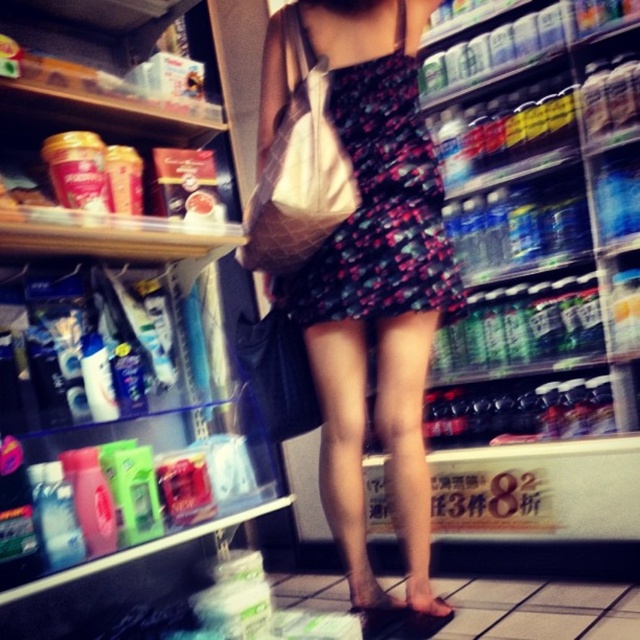
Based on the photo, can you confirm if floral-patterned fabric dress at center is positioned to the right of matte black sandal at lower center?

Incorrect, floral-patterned fabric dress at center is not on the right side of matte black sandal at lower center.

Is floral-patterned fabric dress at center thinner than matte black sandal at lower center?

In fact, floral-patterned fabric dress at center might be wider than matte black sandal at lower center.

The height and width of the screenshot is (640, 640). I want to click on floral-patterned fabric dress at center, so click(380, 196).

Is floral dress at center taller than matte black sandal at lower center?

Correct, floral dress at center is much taller as matte black sandal at lower center.

Which is more to the left, floral dress at center or matte black sandal at lower center?

From the viewer's perspective, floral dress at center appears more on the left side.

I want to click on floral dress at center, so click(x=369, y=264).

Find the location of a particular element. This screenshot has height=640, width=640. floral dress at center is located at coordinates (369, 264).

Who is higher up, floral dress at center or brown leather sandal at lower center?

Positioned higher is floral dress at center.

From the picture: Does floral dress at center have a greater width compared to brown leather sandal at lower center?

Yes, floral dress at center is wider than brown leather sandal at lower center.

Identify the location of floral dress at center. (369, 264).